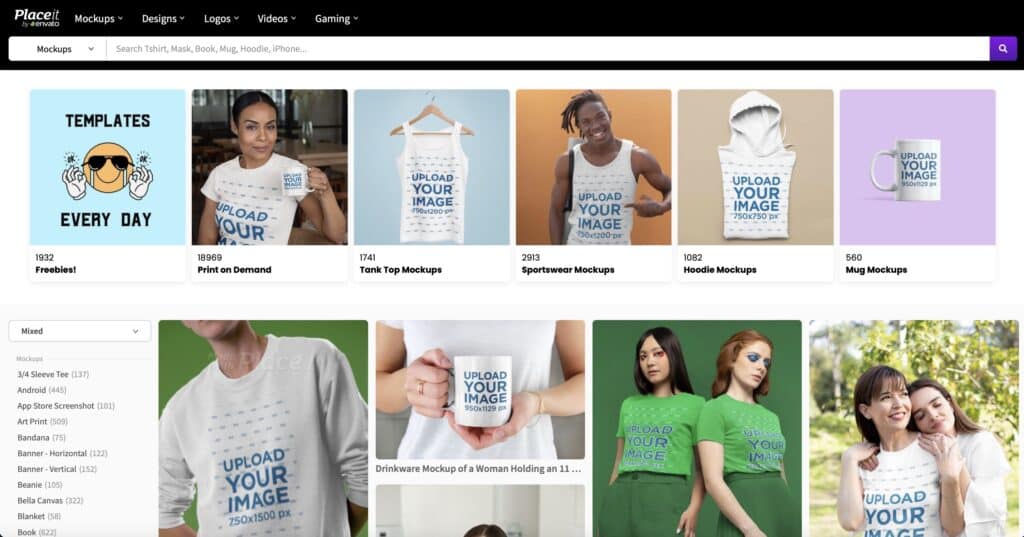
You are a GUI agent. You are given a task and a screenshot of the screen. Output one action in this format:
    pyautogui.click(x=<x>, y=<y>)
    Task: Click on the hand cupping mug
    The width and height of the screenshot is (1024, 537).
    Given the screenshot: What is the action you would take?
    click(527, 401)